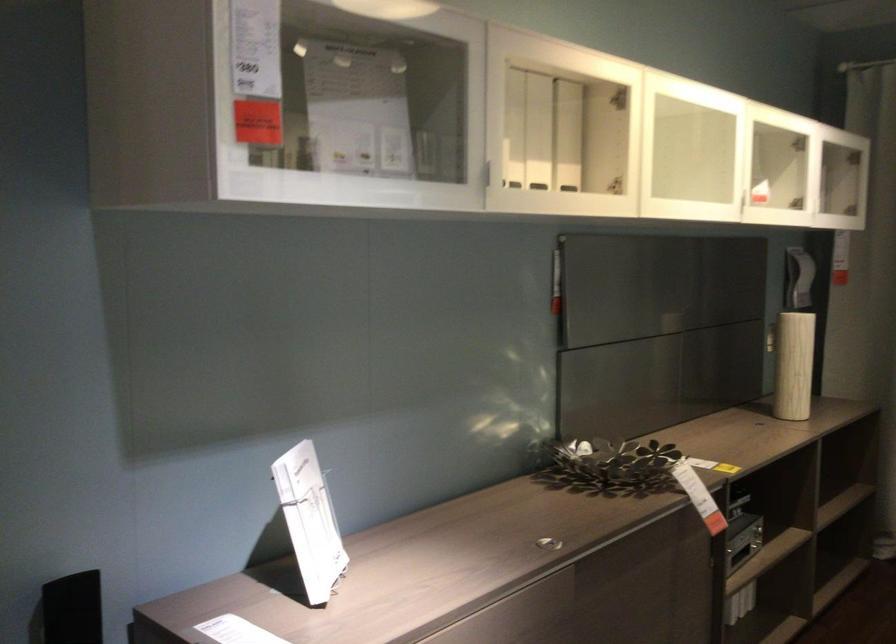
This screenshot has width=896, height=644. I want to click on recessed cabinet handle, so click(x=487, y=174).